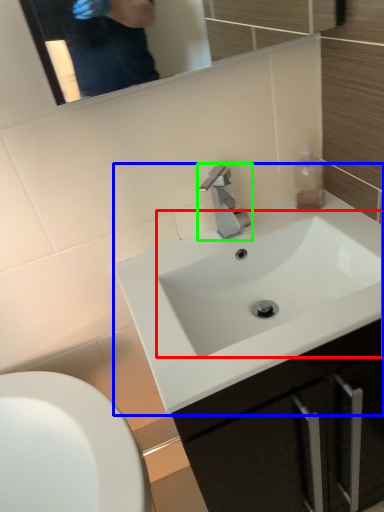
Question: Which object is the farthest from sink (highlighted by a red box)? Choose among these: sink (highlighted by a blue box) or tap (highlighted by a green box).

Choices:
 (A) sink
 (B) tap

Answer: (B)